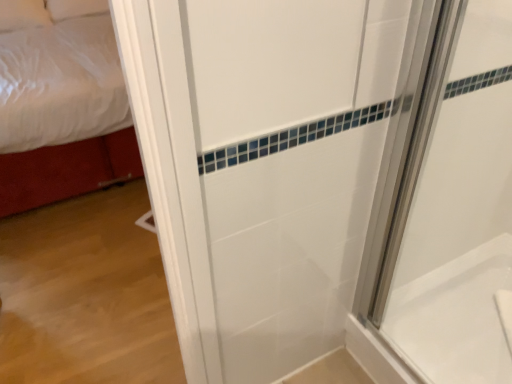
Question: From the image's perspective, is white glossy bathtub at lower right on white fabric bed at left?

Choices:
 (A) yes
 (B) no

Answer: (B)

Question: Is white glossy bathtub at lower right positioned beyond the bounds of white fabric bed at left?

Choices:
 (A) no
 (B) yes

Answer: (B)

Question: Is white glossy bathtub at lower right aimed at white fabric bed at left?

Choices:
 (A) yes
 (B) no

Answer: (B)

Question: From the image's perspective, is white glossy bathtub at lower right beneath white fabric bed at left?

Choices:
 (A) no
 (B) yes

Answer: (B)

Question: Does white glossy bathtub at lower right lie behind white fabric bed at left?

Choices:
 (A) yes
 (B) no

Answer: (B)

Question: From the image's perspective, relative to white glossy bathtub at lower right, is white glossy shower door at right above or below?

Choices:
 (A) below
 (B) above

Answer: (B)

Question: Is white glossy shower door at right in front of or behind white glossy bathtub at lower right in the image?

Choices:
 (A) front
 (B) behind

Answer: (A)

Question: Considering the positions of white glossy shower door at right and white glossy bathtub at lower right in the image, is white glossy shower door at right taller or shorter than white glossy bathtub at lower right?

Choices:
 (A) short
 (B) tall

Answer: (B)

Question: Choose the correct answer: Is white glossy shower door at right inside white glossy bathtub at lower right or outside it?

Choices:
 (A) outside
 (B) inside

Answer: (A)

Question: Is white glossy shower door at right in front of or behind white fabric bed at left in the image?

Choices:
 (A) front
 (B) behind

Answer: (A)

Question: From a real-world perspective, is white glossy shower door at right above or below white fabric bed at left?

Choices:
 (A) above
 (B) below

Answer: (A)

Question: From the image's perspective, is white glossy shower door at right positioned above or below white fabric bed at left?

Choices:
 (A) above
 (B) below

Answer: (B)

Question: Considering the positions of white glossy shower door at right and white fabric bed at left in the image, is white glossy shower door at right taller or shorter than white fabric bed at left?

Choices:
 (A) tall
 (B) short

Answer: (A)

Question: From their relative heights in the image, would you say white glossy bathtub at lower right is taller or shorter than white fabric bed at left?

Choices:
 (A) short
 (B) tall

Answer: (A)

Question: Is white glossy bathtub at lower right inside the boundaries of white fabric bed at left, or outside?

Choices:
 (A) inside
 (B) outside

Answer: (B)